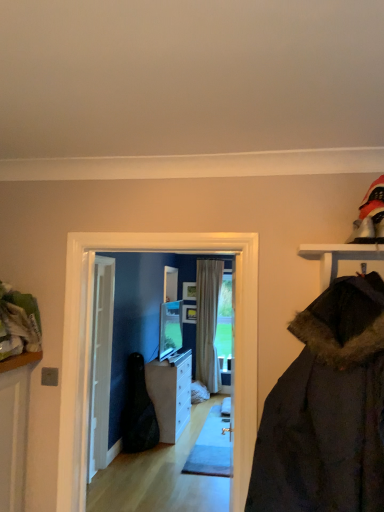
Question: Considering the relative sizes of matte glass screen door at center and black leather guitar case at center in the image provided, is matte glass screen door at center wider than black leather guitar case at center?

Choices:
 (A) yes
 (B) no

Answer: (B)

Question: Considering the relative sizes of matte glass screen door at center and black leather guitar case at center in the image provided, is matte glass screen door at center taller than black leather guitar case at center?

Choices:
 (A) yes
 (B) no

Answer: (A)

Question: From the image's perspective, is matte glass screen door at center on black leather guitar case at center?

Choices:
 (A) no
 (B) yes

Answer: (B)

Question: Is matte glass screen door at center thinner than black leather guitar case at center?

Choices:
 (A) no
 (B) yes

Answer: (B)

Question: Is matte glass screen door at center outside black leather guitar case at center?

Choices:
 (A) no
 (B) yes

Answer: (B)

Question: Does matte glass screen door at center lie in front of black leather guitar case at center?

Choices:
 (A) no
 (B) yes

Answer: (B)

Question: Is beige fabric curtain at center positioned far away from white wooden door at center?

Choices:
 (A) no
 (B) yes

Answer: (B)

Question: From the image's perspective, would you say beige fabric curtain at center is shown under white wooden door at center?

Choices:
 (A) yes
 (B) no

Answer: (A)

Question: Is beige fabric curtain at center in contact with white wooden door at center?

Choices:
 (A) no
 (B) yes

Answer: (A)

Question: Is the position of beige fabric curtain at center more distant than that of white wooden door at center?

Choices:
 (A) yes
 (B) no

Answer: (A)

Question: Is white wooden door at center at the back of beige fabric curtain at center?

Choices:
 (A) yes
 (B) no

Answer: (B)

Question: Is beige fabric curtain at center shorter than white wooden door at center?

Choices:
 (A) yes
 (B) no

Answer: (B)

Question: Is white glossy cabinet at center at the left side of matte glass screen door at center?

Choices:
 (A) no
 (B) yes

Answer: (B)